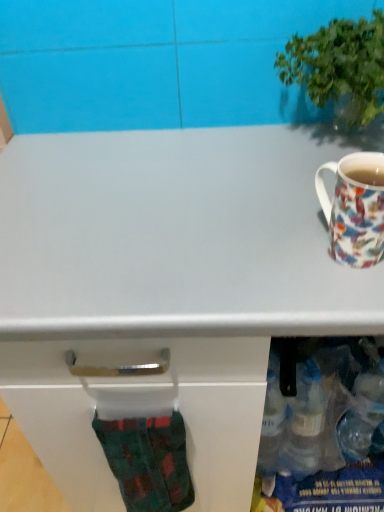
Find the location of `vacant space situated on the left part of green leafy plant at upper right`. vacant space situated on the left part of green leafy plant at upper right is located at coordinates (223, 165).